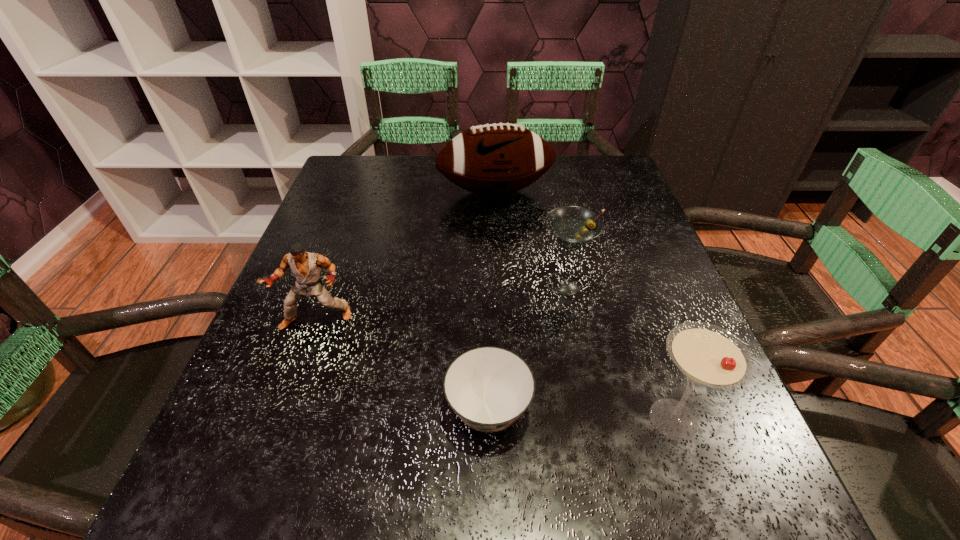
You are a GUI agent. You are given a task and a screenshot of the screen. Output one action in this format:
    pyautogui.click(x=<x>, y=<y>)
    Task: Click on the vacant space situated 0.120m on the front-facing side of the third nearest object
    The image size is (960, 540).
    Given the screenshot: What is the action you would take?
    click(291, 392)

Image resolution: width=960 pixels, height=540 pixels. I want to click on vacant region located on the back of the rightmost object, so click(619, 263).

The image size is (960, 540). In order to click on vacant space located on the left of the shortest object in this screenshot , I will do `click(381, 410)`.

In order to click on object located in the far edge section of the desktop in this screenshot , I will do `click(493, 159)`.

The width and height of the screenshot is (960, 540). In order to click on object present at the left edge in this screenshot , I will do `click(306, 267)`.

Where is `object at the right edge`? Image resolution: width=960 pixels, height=540 pixels. object at the right edge is located at coordinates (707, 355).

Locate an element on the screen. free space at the near edge is located at coordinates (486, 533).

In order to click on vacant area at the left edge of the desktop in this screenshot , I will do `click(348, 232)`.

At what (x,y) coordinates should I click in order to perform the action: click on vacant region at the far left corner of the desktop. Please return your answer as a coordinate pair (x, y). Looking at the image, I should click on (375, 159).

This screenshot has height=540, width=960. What are the coordinates of `blank space at the far right corner` in the screenshot? It's located at (601, 157).